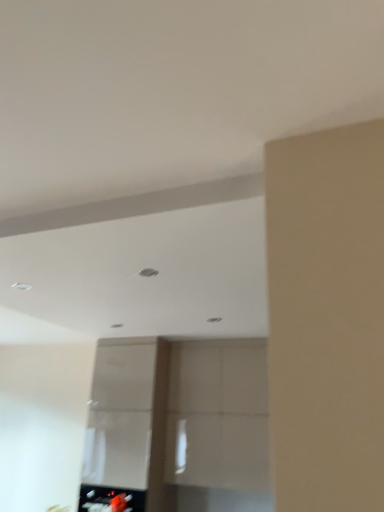
Question: Should I look upward or downward to see metallic silver toaster at lower center?

Choices:
 (A) down
 (B) up

Answer: (A)